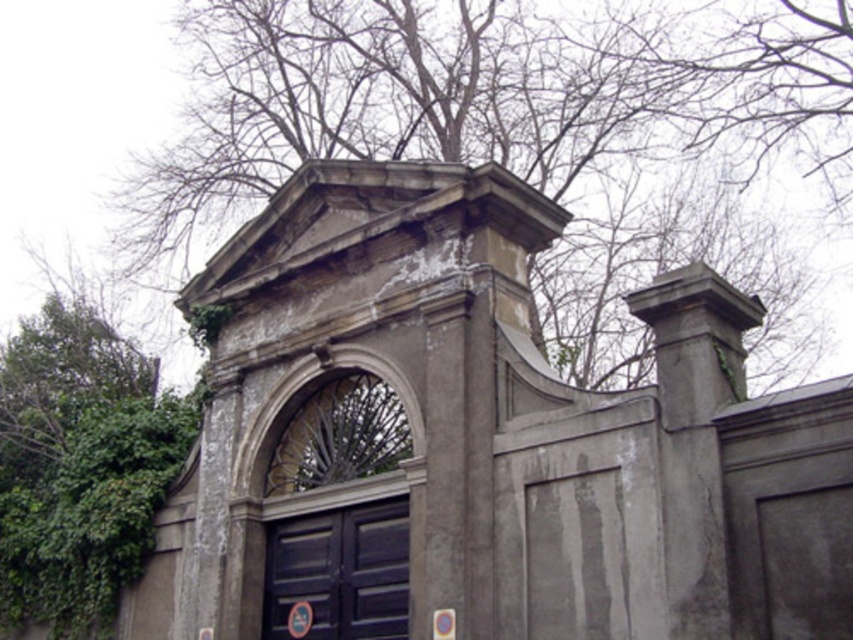
Locate an element on the screen. Image resolution: width=853 pixels, height=640 pixels. green leafy tree at upper center is located at coordinates (480, 148).

From the picture: Is green leafy tree at upper center below dark blue wooden door at center?

No, green leafy tree at upper center is not below dark blue wooden door at center.

Where is `green leafy tree at upper center`? green leafy tree at upper center is located at coordinates (480, 148).